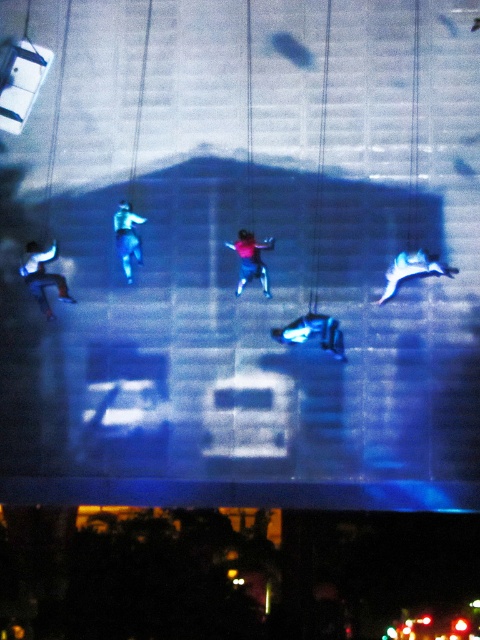
Question: Based on their relative distances, which object is farther from the shiny metallic car at center?

Choices:
 (A) blue fabric pants at center
 (B) white matte bird at upper right
 (C) matte blue jeans at lower left
 (D) blue fabric figure at center

Answer: (C)

Question: Does shiny metallic car at center come in front of blue fabric figure at center?

Choices:
 (A) no
 (B) yes

Answer: (B)

Question: Which is farther from the matte blue jeans at lower left?

Choices:
 (A) white matte bird at upper right
 (B) blue fabric pants at center

Answer: (A)

Question: Which point is farther to the camera?

Choices:
 (A) (420, 259)
 (B) (324, 317)
 (C) (132, 220)

Answer: (C)

Question: Can you confirm if blue fabric pants at center is smaller than blue fabric figure at center?

Choices:
 (A) yes
 (B) no

Answer: (B)

Question: Can you confirm if shiny metallic car at center is positioned to the left of blue fabric pants at center?

Choices:
 (A) yes
 (B) no

Answer: (B)